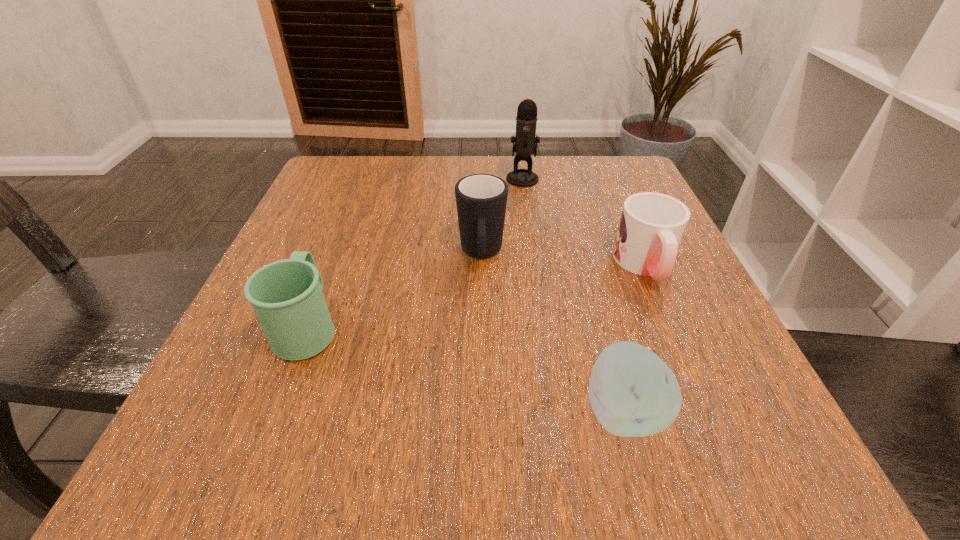
At what (x,y) coordinates should I click in order to perform the action: click on unoccupied position between the rightmost mug and the second object from left to right. Please return your answer as a coordinate pair (x, y). The height and width of the screenshot is (540, 960). Looking at the image, I should click on (564, 260).

Locate an element on the screen. vacant space that is in between the tallest object and the rightmost mug is located at coordinates (584, 222).

Where is `free space between the tallest object and the leftmost mug`? This screenshot has width=960, height=540. free space between the tallest object and the leftmost mug is located at coordinates (416, 253).

Where is `empty space that is in between the second mug from right to left and the leftmost mug`? The image size is (960, 540). empty space that is in between the second mug from right to left and the leftmost mug is located at coordinates (395, 291).

Locate an element on the screen. the third closest object to the apple is located at coordinates (287, 297).

Locate which object ranks in proximity to the apple. Please provide its 2D coordinates. Your answer should be formatted as a tuple, i.e. [(x, y)], where the tuple contains the x and y coordinates of a point satisfying the conditions above.

[(652, 225)]

Identify which mug is the closest to the farthest object. Please provide its 2D coordinates. Your answer should be formatted as a tuple, i.e. [(x, y)], where the tuple contains the x and y coordinates of a point satisfying the conditions above.

[(481, 199)]

Locate which mug is the closest to the second object from left to right. Please provide its 2D coordinates. Your answer should be formatted as a tuple, i.e. [(x, y)], where the tuple contains the x and y coordinates of a point satisfying the conditions above.

[(287, 297)]

At what (x,y) coordinates should I click in order to perform the action: click on vacant position in the image that satisfies the following two spatial constraints: 1. on the side of the apple with the handle; 2. on the left side of the second object from left to right. Please return your answer as a coordinate pair (x, y). Looking at the image, I should click on (482, 411).